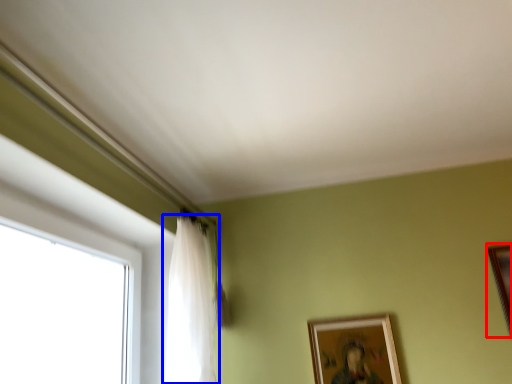
Question: Among these objects, which one is nearest to the camera, picture frame (highlighted by a red box) or curtain (highlighted by a blue box)?

Choices:
 (A) picture frame
 (B) curtain

Answer: (B)